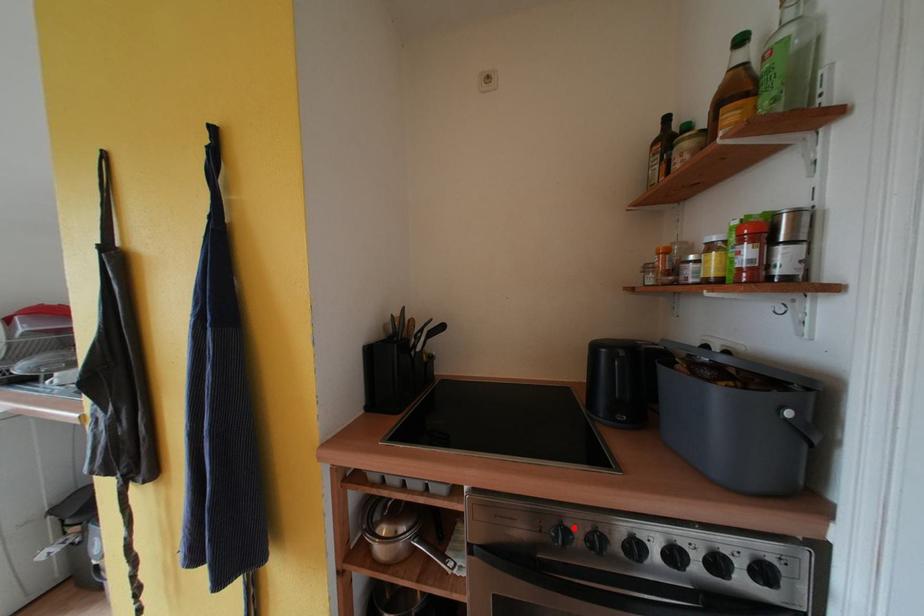
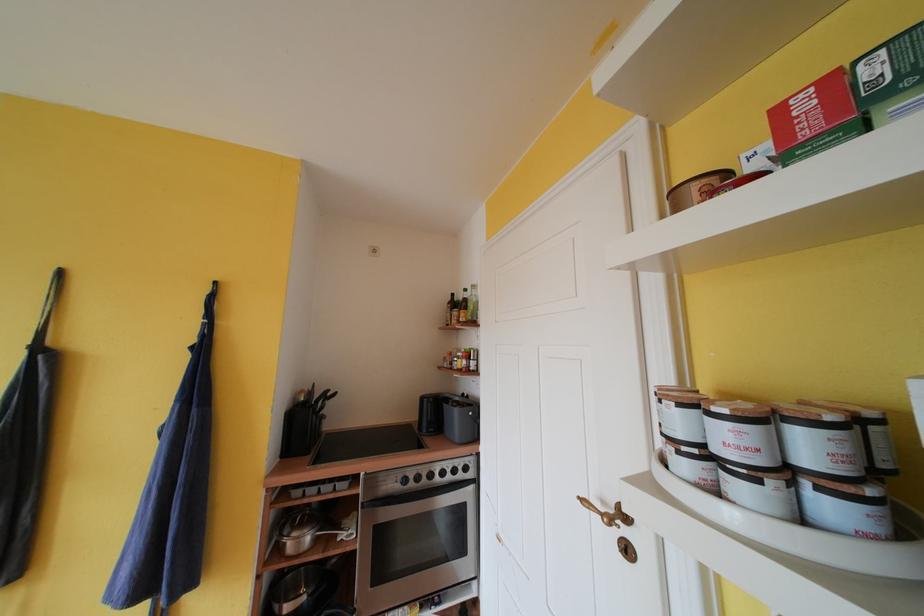
Where in the second image is the point corresponding to the highlighted location from the first image?

(412, 477)